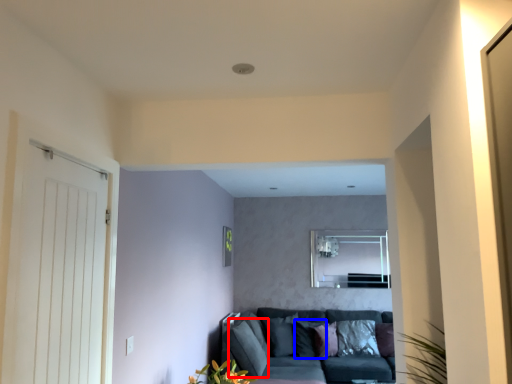
Question: Which point is further to the camera, pillow (highlighted by a red box) or pillow (highlighted by a blue box)?

Choices:
 (A) pillow
 (B) pillow

Answer: (B)